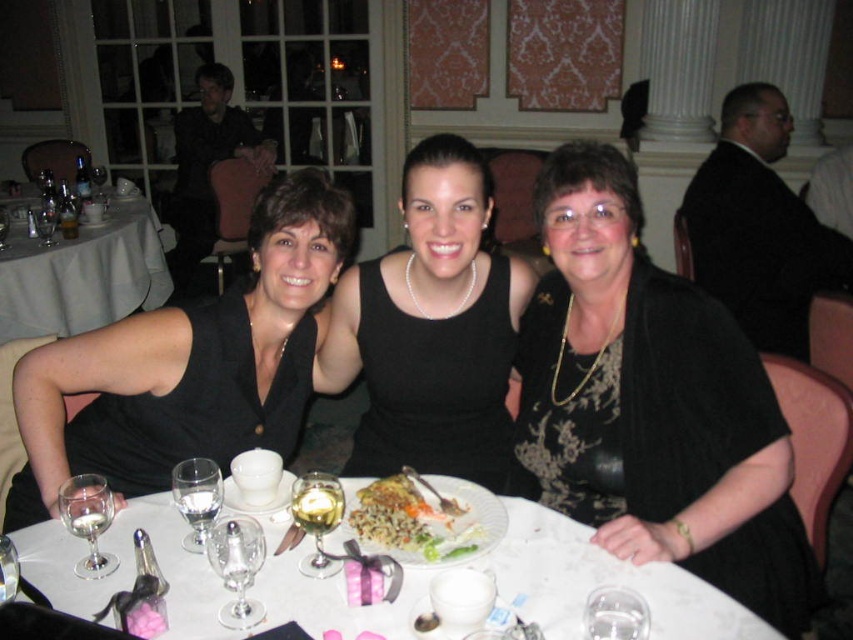
From the picture: You are at a formal dinner and want to place your napkin on the table. You have two options for placement based on coordinates given in the image. The first option is at point (x=467, y=548) and the second is at point (x=228, y=570). Which point is closer to you, the viewer?

Point (x=467, y=548) is closer to the viewer than point (x=228, y=570).

You are a waiter at a formal dinner. You need to place a new dessert plate on the table. The dessert plate must be placed to the right of the clear glass wine glass at center. Is the golden brown omelette at center currently blocking that spot?

The golden brown omelette at center is to the right of the clear glass wine glass at center, so it is blocking the spot where the dessert plate needs to be placed to the right of the clear glass wine glass at center.

You are a photographer at the event and need to ensure that the black satin dress at center and the white glossy plate at center are both visible in the photo. Given their sizes, which object should you focus on to ensure both are in frame without cropping?

The black satin dress at center is larger in size than the white glossy plate at center. To ensure both are visible without cropping, focus on the larger object, the black satin dress at center, as it requires more space in the frame.